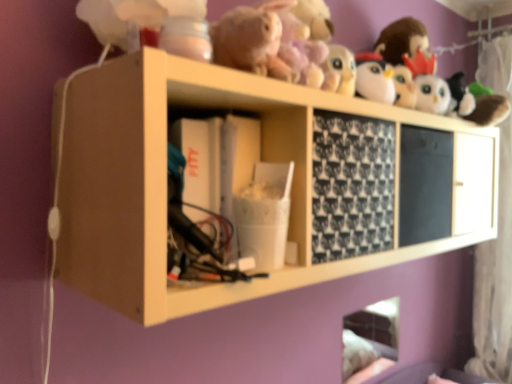
Question: From a real-world perspective, is white sheer curtain at right above or below wooden shelf at upper center?

Choices:
 (A) below
 (B) above

Answer: (A)

Question: Based on their sizes in the image, would you say white sheer curtain at right is bigger or smaller than wooden shelf at upper center?

Choices:
 (A) small
 (B) big

Answer: (A)

Question: Considering the positions of point (486, 253) and point (117, 59), is point (486, 253) closer or farther from the camera than point (117, 59)?

Choices:
 (A) farther
 (B) closer

Answer: (A)

Question: Considering the positions of wooden shelf at upper center and white sheer curtain at right in the image, is wooden shelf at upper center wider or thinner than white sheer curtain at right?

Choices:
 (A) wide
 (B) thin

Answer: (A)

Question: Considering the positions of wooden shelf at upper center and white sheer curtain at right in the image, is wooden shelf at upper center taller or shorter than white sheer curtain at right?

Choices:
 (A) tall
 (B) short

Answer: (B)

Question: From a real-world perspective, is wooden shelf at upper center positioned above or below white sheer curtain at right?

Choices:
 (A) below
 (B) above

Answer: (B)

Question: Is point (112, 208) closer or farther from the camera than point (483, 69)?

Choices:
 (A) farther
 (B) closer

Answer: (B)